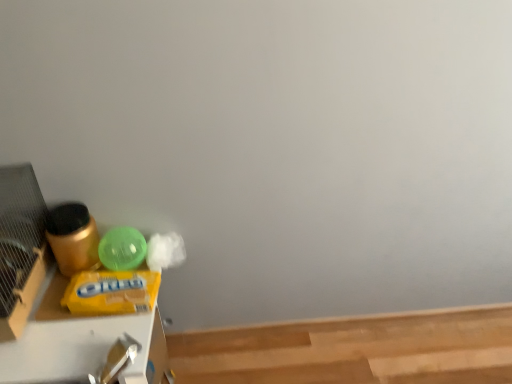
Image resolution: width=512 pixels, height=384 pixels. Describe the element at coordinates (82, 344) in the screenshot. I see `yellow matte plastic wipes at left` at that location.

Where is `yellow matte plastic wipes at left`? The height and width of the screenshot is (384, 512). yellow matte plastic wipes at left is located at coordinates (82, 344).

Locate an element on the screen. The image size is (512, 384). light brown smooth wood at lower right is located at coordinates [354, 350].

Looking at this image, what is the approximate width of light brown smooth wood at lower right?

The width of light brown smooth wood at lower right is 3.98 feet.

What do you see at coordinates (354, 350) in the screenshot? Image resolution: width=512 pixels, height=384 pixels. I see `light brown smooth wood at lower right` at bounding box center [354, 350].

Locate an element on the screen. The height and width of the screenshot is (384, 512). yellow matte plastic wipes at left is located at coordinates (82, 344).

Consider the image. Is yellow matte plastic wipes at left to the right of light brown smooth wood at lower right from the viewer's perspective?

No, yellow matte plastic wipes at left is not to the right of light brown smooth wood at lower right.

Which object is closer to the camera, yellow matte plastic wipes at left or light brown smooth wood at lower right?

yellow matte plastic wipes at left is more forward.

Which is behind, point (100, 326) or point (485, 355)?

The point (485, 355) is more distant.

From the image's perspective, which one is positioned higher, yellow matte plastic wipes at left or light brown smooth wood at lower right?

From the image's view, yellow matte plastic wipes at left is above.

From a real-world perspective, which object stands above the other?

In real-world perspective, yellow matte plastic wipes at left is above.

Considering the relative sizes of yellow matte plastic wipes at left and light brown smooth wood at lower right in the image provided, is yellow matte plastic wipes at left wider than light brown smooth wood at lower right?

In fact, yellow matte plastic wipes at left might be narrower than light brown smooth wood at lower right.

From their relative heights in the image, would you say yellow matte plastic wipes at left is taller or shorter than light brown smooth wood at lower right?

Clearly, yellow matte plastic wipes at left is taller compared to light brown smooth wood at lower right.

Can you confirm if yellow matte plastic wipes at left is smaller than light brown smooth wood at lower right?

Incorrect, yellow matte plastic wipes at left is not smaller in size than light brown smooth wood at lower right.

Is light brown smooth wood at lower right surrounded by yellow matte plastic wipes at left?

Definitely not — light brown smooth wood at lower right is not inside yellow matte plastic wipes at left.

Is yellow matte plastic wipes at left not near light brown smooth wood at lower right?

yellow matte plastic wipes at left is actually quite close to light brown smooth wood at lower right.

Does yellow matte plastic wipes at left turn towards light brown smooth wood at lower right?

No, yellow matte plastic wipes at left is not aimed at light brown smooth wood at lower right.

How different are the orientations of yellow matte plastic wipes at left and light brown smooth wood at lower right in degrees?

The facing directions of yellow matte plastic wipes at left and light brown smooth wood at lower right are 90.9 degrees apart.

The width and height of the screenshot is (512, 384). In order to click on wood below the yellow matte plastic wipes at left (from a real-world perspective) in this screenshot , I will do (x=354, y=350).

From the picture: Considering the relative positions of light brown smooth wood at lower right and yellow matte plastic wipes at left in the image provided, is light brown smooth wood at lower right to the left or to the right of yellow matte plastic wipes at left?

Clearly, light brown smooth wood at lower right is on the right of yellow matte plastic wipes at left in the image.

Is light brown smooth wood at lower right in front of or behind yellow matte plastic wipes at left in the image?

light brown smooth wood at lower right is positioned farther from the viewer than yellow matte plastic wipes at left.

Considering the points (255, 343) and (112, 323), which point is behind, point (255, 343) or point (112, 323)?

The point (255, 343) is behind.

From the image's perspective, is light brown smooth wood at lower right located beneath yellow matte plastic wipes at left?

Yes, from the image's perspective, light brown smooth wood at lower right is below yellow matte plastic wipes at left.

From a real-world perspective, does light brown smooth wood at lower right sit lower than yellow matte plastic wipes at left?

Yes.

Which object is thinner, light brown smooth wood at lower right or yellow matte plastic wipes at left?

Thinner between the two is yellow matte plastic wipes at left.

Which of these two, light brown smooth wood at lower right or yellow matte plastic wipes at left, stands shorter?

With less height is light brown smooth wood at lower right.

Who is smaller, light brown smooth wood at lower right or yellow matte plastic wipes at left?

light brown smooth wood at lower right.

Is light brown smooth wood at lower right surrounding yellow matte plastic wipes at left?

No, yellow matte plastic wipes at left is not a part of light brown smooth wood at lower right.

In the scene shown: Would you say light brown smooth wood at lower right is a long distance from yellow matte plastic wipes at left?

Actually, light brown smooth wood at lower right and yellow matte plastic wipes at left are a little close together.

Could you tell me if light brown smooth wood at lower right is facing yellow matte plastic wipes at left?

No, light brown smooth wood at lower right is not aimed at yellow matte plastic wipes at left.

How different are the orientations of light brown smooth wood at lower right and yellow matte plastic wipes at left in degrees?

90.9 degrees.

How far apart are light brown smooth wood at lower right and yellow matte plastic wipes at left?

They are 25.15 inches apart.

What are the coordinates of `wood located below the yellow matte plastic wipes at left (from the image's perspective)` in the screenshot? It's located at (354, 350).

This screenshot has height=384, width=512. In order to click on furniture above the light brown smooth wood at lower right (from a real-world perspective) in this screenshot , I will do tap(82, 344).

The height and width of the screenshot is (384, 512). I want to click on furniture in front of the light brown smooth wood at lower right, so click(82, 344).